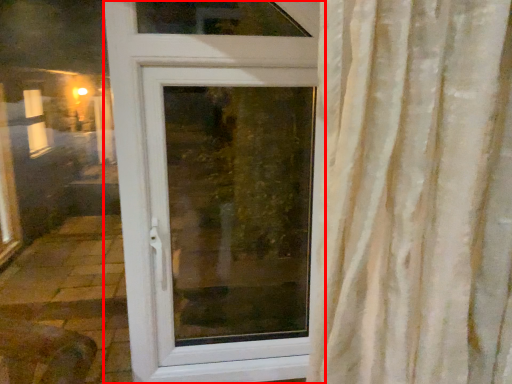
Question: In this image, where is door (annotated by the red box) located relative to window screen?

Choices:
 (A) right
 (B) left

Answer: (B)